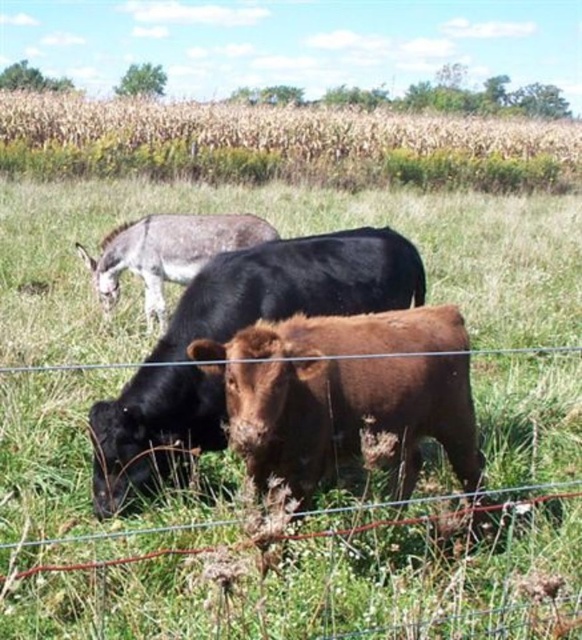
You are a farmer checking the pasture. You see the brown furry bull at center and the gray matte donkey at upper left. Which animal is closer to you?

The brown furry bull at center is closer to the viewer than the gray matte donkey at upper left.

You are a farmer checking the pasture. You notice the brown furry bull at center and the gray matte donkey at upper left. Which animal is positioned lower in the image?

The brown furry bull at center is positioned lower than the gray matte donkey at upper left.

You are standing at the origin point of the coordinate system. You see two points in the image, point 1 at coordinates point (86, 161) and point 2 at coordinates point (300, 353). Which point is closer to you?

Point 2 at coordinates point (300, 353) is closer to you because it is in front of point 1 at coordinates point (86, 161).